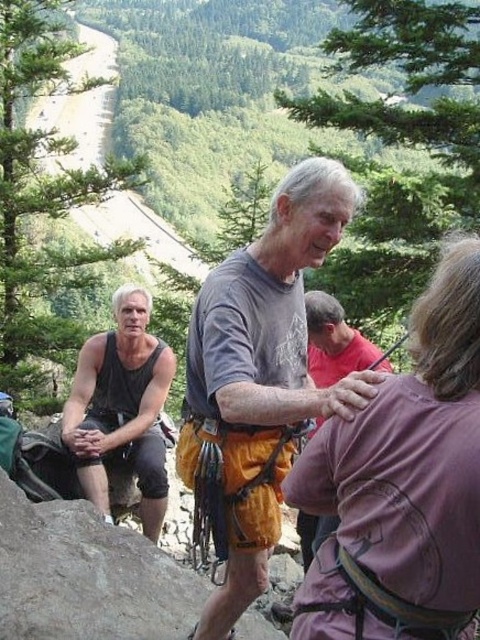
In the scene where a group is climbing in a mountainous forest area, you notice a purple fabric at center and a gray cotton shirt at center. From the perspective of someone standing at the center of the image, which object is positioned to the right?

The purple fabric at center is to the right of the gray cotton shirt at center.

From the picture: You are an observer standing in front of the climbers. You notice the purple fabric at center and the gray cotton shirt at center. Which one is wider?

The gray cotton shirt at center is wider than the purple fabric at center.